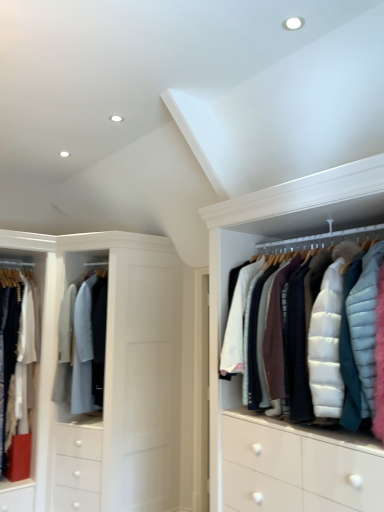
Describe the element at coordinates (18, 366) in the screenshot. The height and width of the screenshot is (512, 384). I see `white cotton shirt at left, the second clothing in the right-to-left sequence` at that location.

Where is `white puffy jacket at upper right`? white puffy jacket at upper right is located at coordinates (344, 339).

Does white puffy jacket at upper right have a greater width compared to white cotton shirt at left, the 1th clothing from the left?

Yes, white puffy jacket at upper right is wider than white cotton shirt at left, the 1th clothing from the left.

Does point (316, 346) lie behind point (16, 320)?

That is False.

Does white puffy jacket at upper right appear on the left side of white cotton shirt at left, the second clothing in the right-to-left sequence?

No.

Between white puffy jacket at upper right and white cotton shirt at left, the second clothing in the right-to-left sequence, which one has smaller size?

white cotton shirt at left, the second clothing in the right-to-left sequence.

Can you confirm if white cotton shirt at left, the second clothing in the right-to-left sequence, is positioned to the right of light gray wool coat at center, placed as the 1th clothing when sorted from right to left?

No, white cotton shirt at left, the second clothing in the right-to-left sequence, is not to the right of light gray wool coat at center, placed as the 1th clothing when sorted from right to left.

From a real-world perspective, who is located higher, white cotton shirt at left, the 1th clothing from the left, or light gray wool coat at center, placed as the 1th clothing when sorted from right to left?

light gray wool coat at center, placed as the 1th clothing when sorted from right to left, is physically above.

Considering the sizes of white cotton shirt at left, the 1th clothing from the left, and light gray wool coat at center, placed as the 1th clothing when sorted from right to left, in the image, is white cotton shirt at left, the 1th clothing from the left, wider or thinner than light gray wool coat at center, placed as the 1th clothing when sorted from right to left,?

In the image, white cotton shirt at left, the 1th clothing from the left, appears to be more narrow than light gray wool coat at center, placed as the 1th clothing when sorted from right to left.

Is white cotton shirt at left, the 1th clothing from the left, turned away from light gray wool coat at center, placed as the 1th clothing when sorted from right to left?

No.

Is light gray wool coat at center, positioned as the 2th clothing in left-to-right order, situated inside white puffy jacket at upper right or outside?

light gray wool coat at center, positioned as the 2th clothing in left-to-right order, is not inside white puffy jacket at upper right, it's outside.

Is point (87, 311) farther from camera compared to point (366, 380)?

Yes, it is.

Can you confirm if light gray wool coat at center, positioned as the 2th clothing in left-to-right order, is smaller than white puffy jacket at upper right?

Yes.

Considering the sizes of white puffy jacket at upper right and light gray wool coat at center, placed as the 1th clothing when sorted from right to left, in the image, is white puffy jacket at upper right taller or shorter than light gray wool coat at center, placed as the 1th clothing when sorted from right to left,?

In the image, white puffy jacket at upper right appears to be shorter than light gray wool coat at center, placed as the 1th clothing when sorted from right to left.

Is white puffy jacket at upper right turned away from light gray wool coat at center, placed as the 1th clothing when sorted from right to left?

No, white puffy jacket at upper right is not facing the opposite direction of light gray wool coat at center, placed as the 1th clothing when sorted from right to left.

Is white puffy jacket at upper right positioned beyond the bounds of light gray wool coat at center, positioned as the 2th clothing in left-to-right order?

Yes.

Can you tell me how much white cotton shirt at left, the second clothing in the right-to-left sequence, and white puffy jacket at upper right differ in facing direction?

The angle between the facing direction of white cotton shirt at left, the second clothing in the right-to-left sequence, and the facing direction of white puffy jacket at upper right is 91.6 degrees.

From a real-world perspective, who is located higher, white cotton shirt at left, the second clothing in the right-to-left sequence, or white puffy jacket at upper right?

In real-world perspective, white puffy jacket at upper right is above.

Is white cotton shirt at left, the second clothing in the right-to-left sequence, further to camera compared to white puffy jacket at upper right?

Yes, the depth of white cotton shirt at left, the second clothing in the right-to-left sequence, is greater than that of white puffy jacket at upper right.

Which is correct: white cotton shirt at left, the 1th clothing from the left, is inside white puffy jacket at upper right, or outside of it?

white cotton shirt at left, the 1th clothing from the left, lies outside white puffy jacket at upper right.

From a real-world perspective, is light gray wool coat at center, positioned as the 2th clothing in left-to-right order, above or below white cotton shirt at left, the 1th clothing from the left?

In terms of real-world spatial position, light gray wool coat at center, positioned as the 2th clothing in left-to-right order, is above white cotton shirt at left, the 1th clothing from the left.

Considering the positions of points (66, 388) and (36, 338), is point (66, 388) farther from camera compared to point (36, 338)?

No, it is in front of (36, 338).

Does light gray wool coat at center, placed as the 1th clothing when sorted from right to left, have a larger size compared to white cotton shirt at left, the 1th clothing from the left?

Indeed, light gray wool coat at center, placed as the 1th clothing when sorted from right to left, has a larger size compared to white cotton shirt at left, the 1th clothing from the left.

Is light gray wool coat at center, placed as the 1th clothing when sorted from right to left, aimed at white cotton shirt at left, the 1th clothing from the left?

No, light gray wool coat at center, placed as the 1th clothing when sorted from right to left, is not aimed at white cotton shirt at left, the 1th clothing from the left.

Find the location of a particular element. the 2nd clothing positioned below the white puffy jacket at upper right (from a real-world perspective) is located at coordinates (18, 366).

Identify the location of clothing that is above the white cotton shirt at left, the 1th clothing from the left (from the image's perspective). (85, 348).

When comparing their distances from light gray wool coat at center, placed as the 1th clothing when sorted from right to left, does white puffy jacket at upper right or white cotton shirt at left, the second clothing in the right-to-left sequence, seem closer?

Based on the image, white cotton shirt at left, the second clothing in the right-to-left sequence, appears to be nearer to light gray wool coat at center, placed as the 1th clothing when sorted from right to left.

Looking at the image, which one is located closer to white puffy jacket at upper right, light gray wool coat at center, placed as the 1th clothing when sorted from right to left, or white cotton shirt at left, the second clothing in the right-to-left sequence?

The object closer to white puffy jacket at upper right is light gray wool coat at center, placed as the 1th clothing when sorted from right to left.

Based on their spatial positions, is white cotton shirt at left, the 1th clothing from the left, or light gray wool coat at center, positioned as the 2th clothing in left-to-right order, further from white puffy jacket at upper right?

Based on the image, white cotton shirt at left, the 1th clothing from the left, appears to be further to white puffy jacket at upper right.

In the scene shown: When comparing their distances from white cotton shirt at left, the 1th clothing from the left, does light gray wool coat at center, positioned as the 2th clothing in left-to-right order, or white puffy jacket at upper right seem further?

Based on the image, white puffy jacket at upper right appears to be further to white cotton shirt at left, the 1th clothing from the left.

From the image, which object appears to be nearer to light gray wool coat at center, positioned as the 2th clothing in left-to-right order, white cotton shirt at left, the second clothing in the right-to-left sequence, or white puffy jacket at upper right?

Among the two, white cotton shirt at left, the second clothing in the right-to-left sequence, is located nearer to light gray wool coat at center, positioned as the 2th clothing in left-to-right order.

Looking at the image, which one is located further to white cotton shirt at left, the 1th clothing from the left, white puffy jacket at upper right or light gray wool coat at center, placed as the 1th clothing when sorted from right to left?

Among the two, white puffy jacket at upper right is located further to white cotton shirt at left, the 1th clothing from the left.

This screenshot has width=384, height=512. What are the coordinates of `clothing between white cotton shirt at left, the 1th clothing from the left, and white puffy jacket at upper right, in the horizontal direction` in the screenshot? It's located at (85, 348).